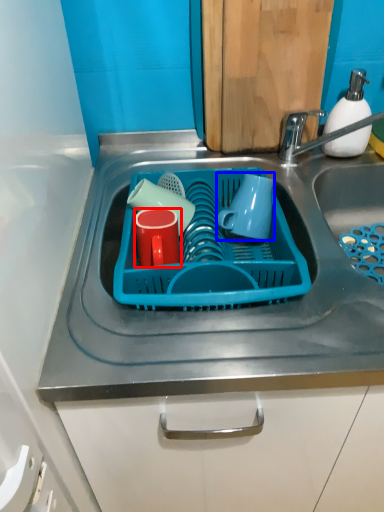
Question: Which object appears closest to the camera in this image, tableware (highlighted by a red box) or mug (highlighted by a blue box)?

Choices:
 (A) tableware
 (B) mug

Answer: (A)